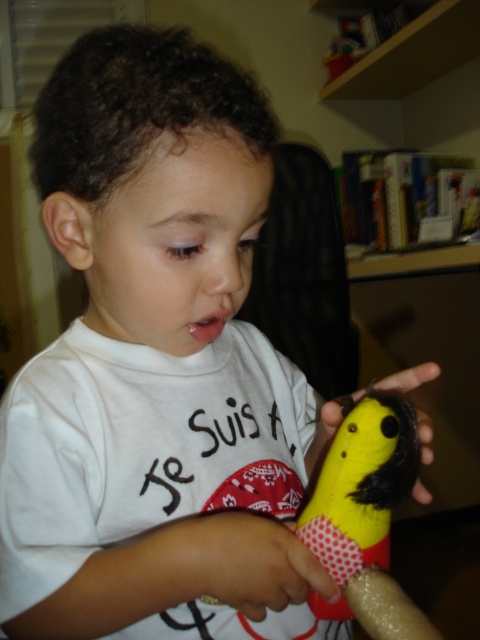
You are a delivery robot with a package that needs to be placed exactly between the two points marked as point (x=298, y=580). Can you determine if there is enough space to place the package there?

The two points marked as point (x=298, y=580) are 15.42 inches apart. Since there is only one point listed, it is unclear if there is another point to determine the space between them. Please provide more information about the second point to calculate the required space for the package.